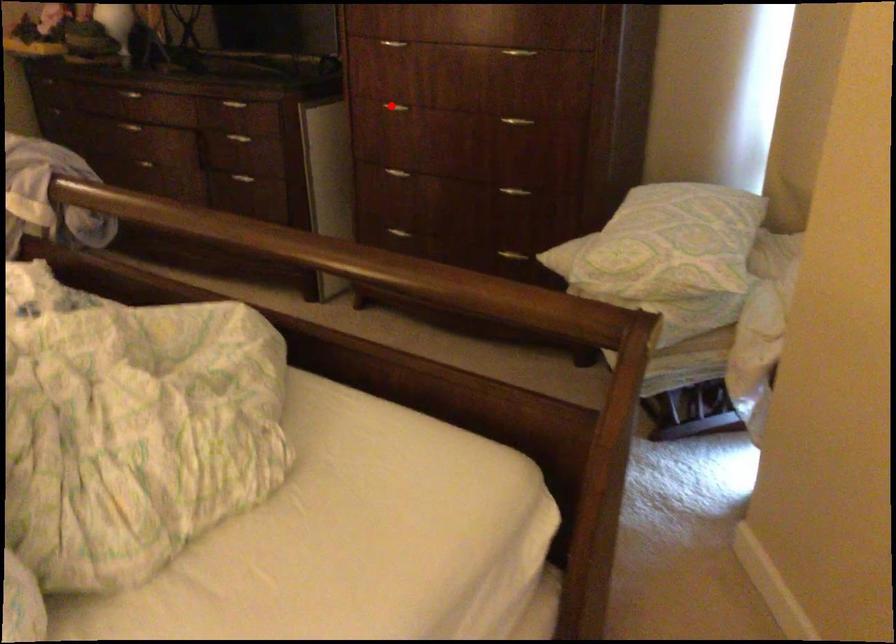
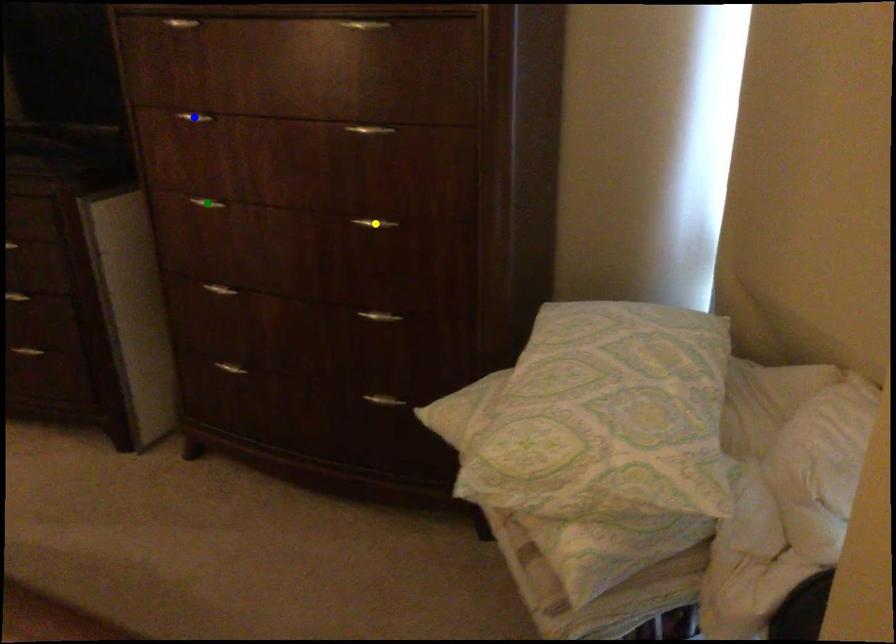
Question: I am providing you with two images of the same scene from different viewpoints. A red point is marked on the first image. You are given multiple points on the second image. In image 2, which mark is for the same physical point as the one in image 1?

Choices:
 (A) blue point
 (B) green point
 (C) yellow point

Answer: (B)